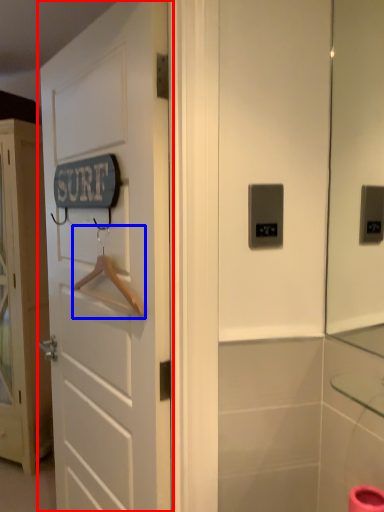
Question: Which object is further to the camera taking this photo, door (highlighted by a red box) or hanger (highlighted by a blue box)?

Choices:
 (A) door
 (B) hanger

Answer: (B)